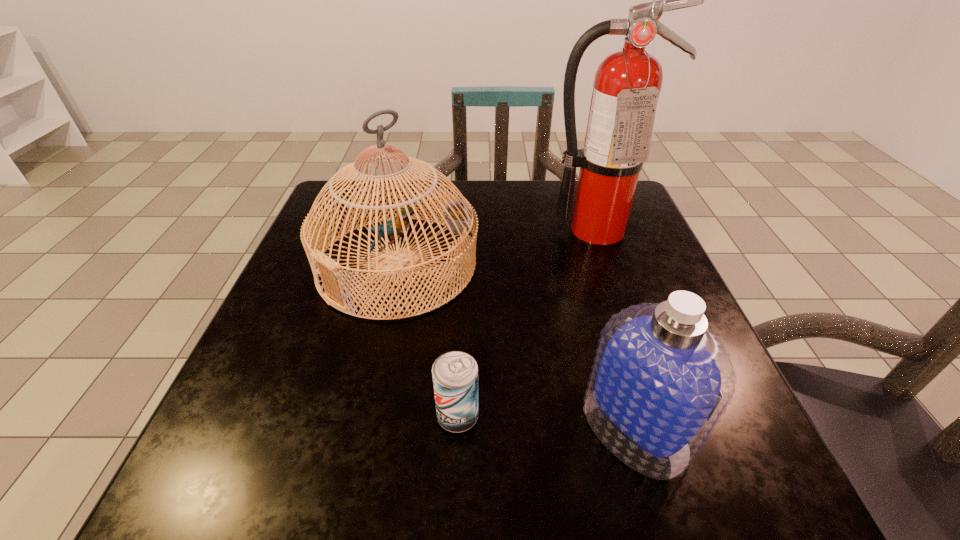
You are a GUI agent. You are given a task and a screenshot of the screen. Output one action in this format:
    pyautogui.click(x=<x>, y=<y>)
    Task: Click on the third closest object to the birdcage
    Image resolution: width=960 pixels, height=540 pixels.
    Given the screenshot: What is the action you would take?
    pyautogui.click(x=661, y=380)

Find the location of a particular element. object that ranks as the second closest to the birdcage is located at coordinates (455, 374).